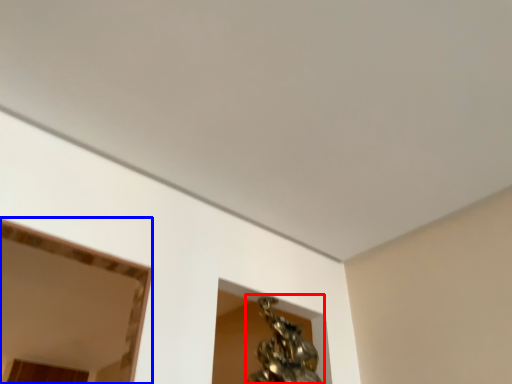
Question: Among these objects, which one is nearest to the camera, bronze sculpture (highlighted by a red box) or mirror (highlighted by a blue box)?

Choices:
 (A) bronze sculpture
 (B) mirror

Answer: (A)